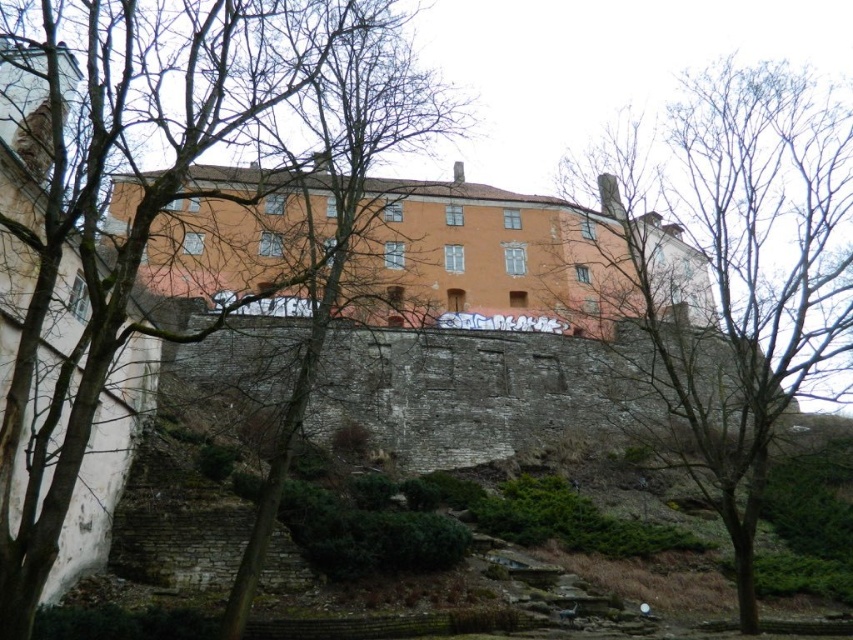
Question: Does bare branches at center appear on the left side of bare branches at upper center?

Choices:
 (A) no
 (B) yes

Answer: (B)

Question: Is bare branches at center bigger than bare branches at upper center?

Choices:
 (A) no
 (B) yes

Answer: (B)

Question: Which of the following is the closest to the observer?

Choices:
 (A) (213, 6)
 (B) (689, 88)

Answer: (A)

Question: Which object is farther from the camera taking this photo?

Choices:
 (A) bare branches at upper center
 (B) bare branches at center

Answer: (A)

Question: Is bare branches at center above bare branches at upper center?

Choices:
 (A) no
 (B) yes

Answer: (B)